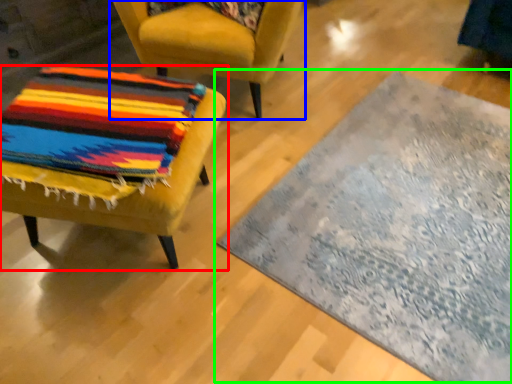
Question: Based on their relative distances, which object is farther from chair (highlighted by a red box)? Choose from chair (highlighted by a blue box) and mat (highlighted by a green box).

Choices:
 (A) chair
 (B) mat

Answer: (B)